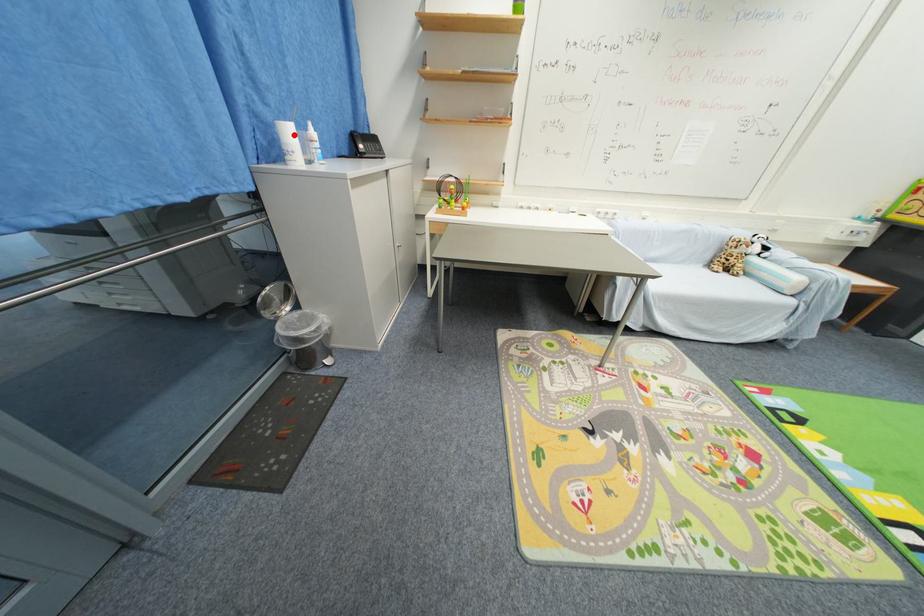
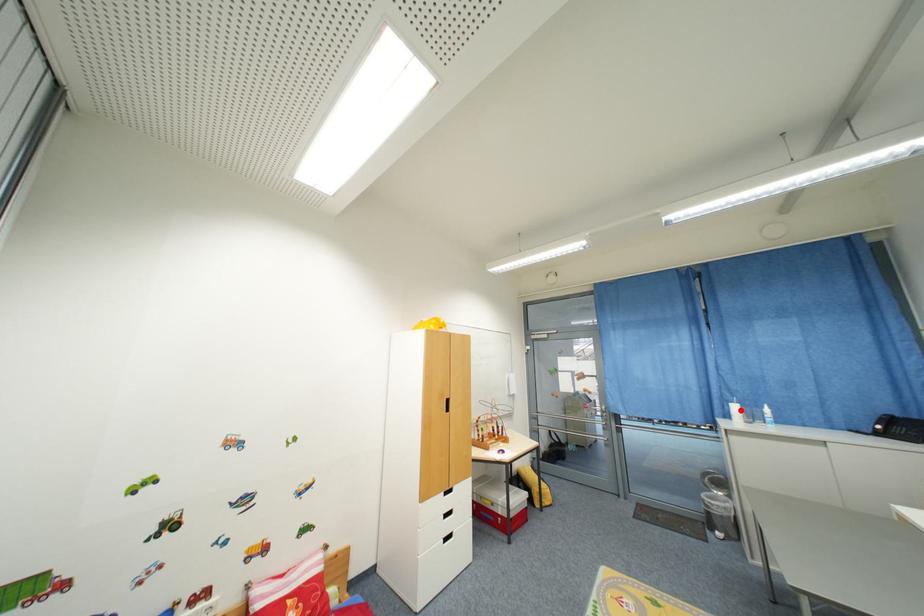
I am providing you with two images of the same scene from different viewpoints. A red point is marked on the first image and another point is marked on the second image. Is the marked point in image1 the same physical position as the marked point in image2?

Yes